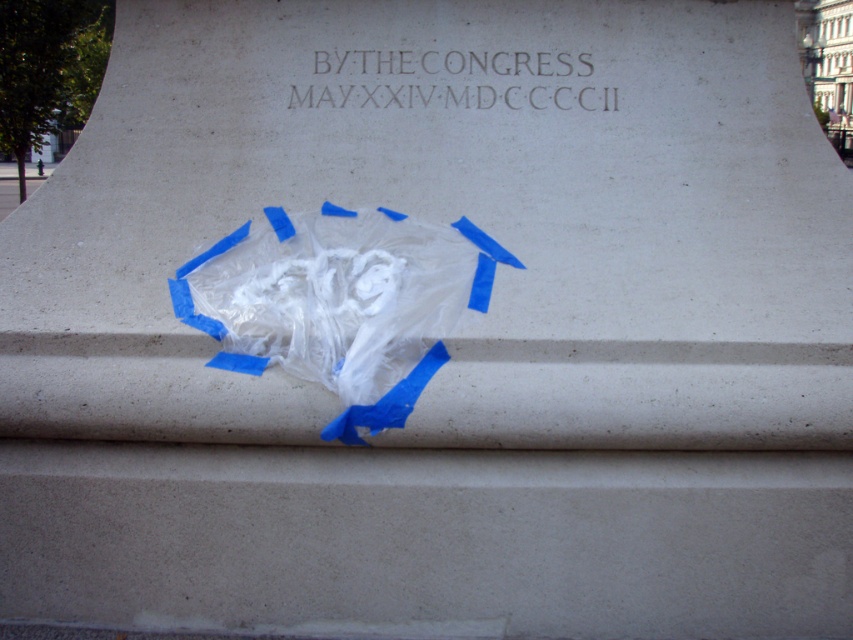
Is translucent plastic bag at center smaller than dark gray stone inscription at upper center?

No.

Is translucent plastic bag at center to the right of dark gray stone inscription at upper center from the viewer's perspective?

No, translucent plastic bag at center is not to the right of dark gray stone inscription at upper center.

Is point (354, 442) more distant than point (553, 67)?

No, (354, 442) is closer to viewer.

Where is `translucent plastic bag at center`? Image resolution: width=853 pixels, height=640 pixels. translucent plastic bag at center is located at coordinates (341, 301).